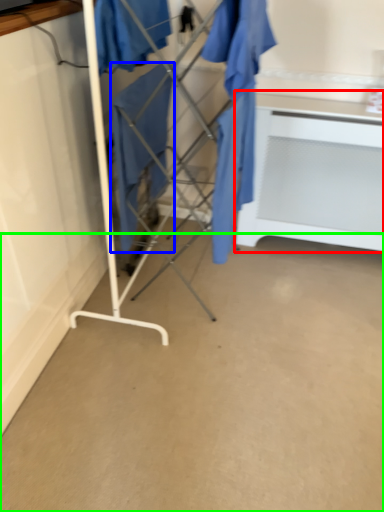
Question: Which object is positioned closest to table (highlighted by a red box)? Select from clothing (highlighted by a blue box) and concrete (highlighted by a green box).

Choices:
 (A) clothing
 (B) concrete

Answer: (A)